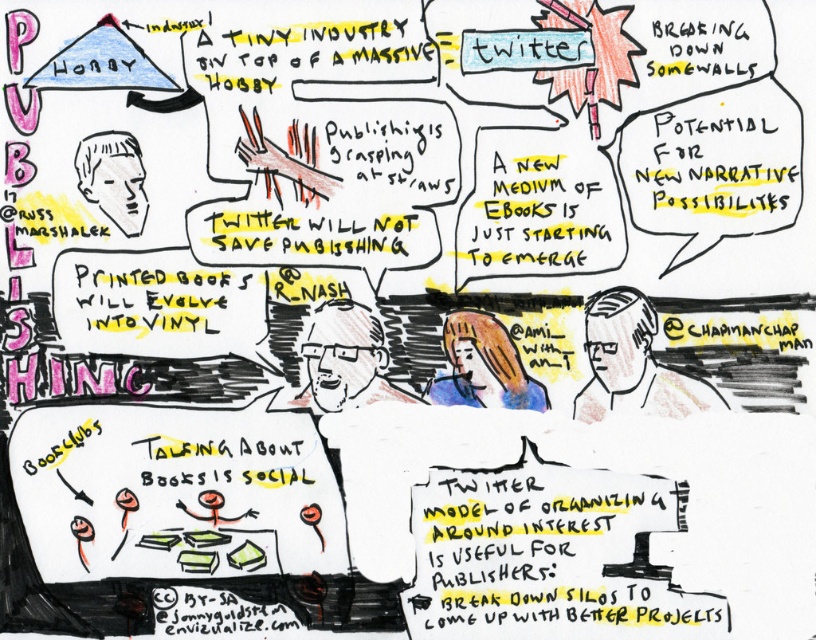
Based on the scene description, what is the location of the point at coordinates (x=548, y=556)?

The point at coordinates (x=548, y=556) is located on the yellow paper text at center.

You are an artist reviewing the image and want to add a highlight to the point that is closer to you. Which point should you choose between point (322, 355) and point (135, 160)?

Point (135, 160) is closer to the viewer, so you should highlight that point.